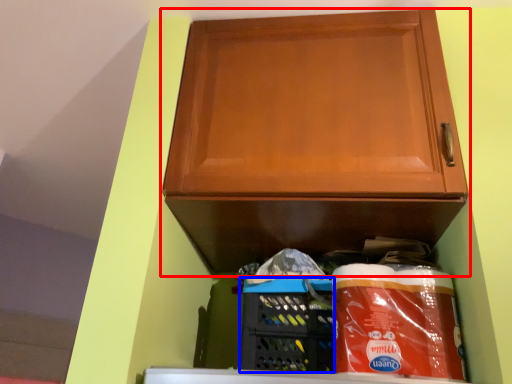
Question: Which point is further to the camera, cabinetry (highlighted by a red box) or basket (highlighted by a blue box)?

Choices:
 (A) cabinetry
 (B) basket

Answer: (B)